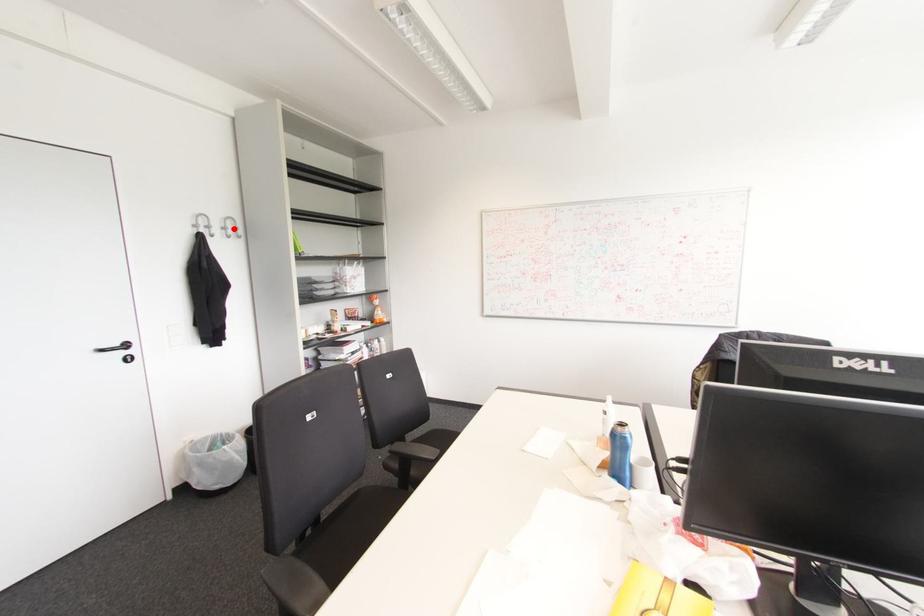
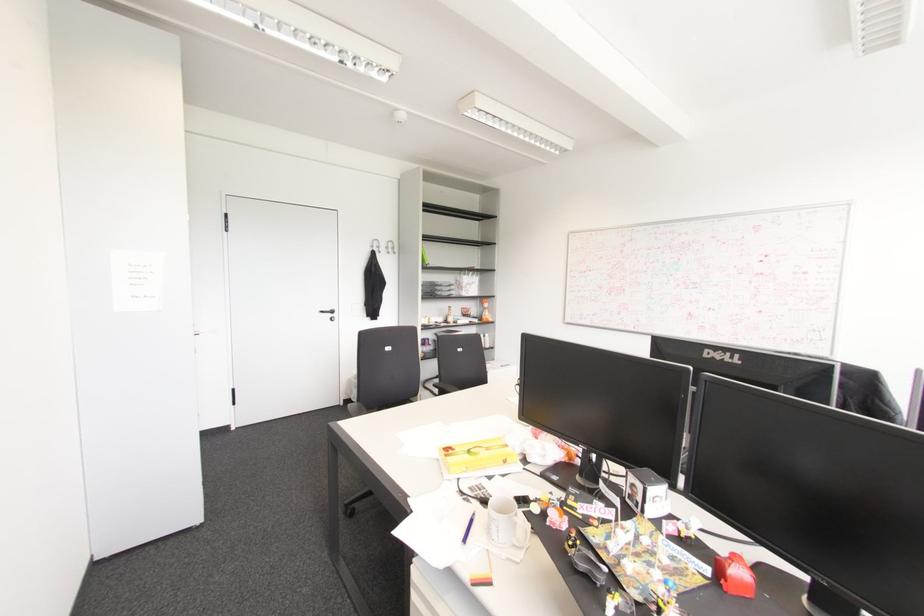
Locate, in the second image, the point that corresponds to the highlighted location in the first image.

(392, 248)